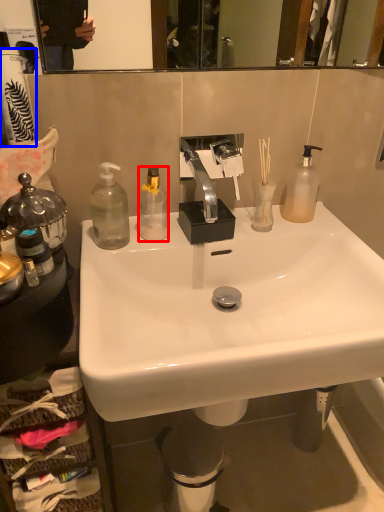
Question: Among these objects, which one is farthest to the camera, bottle (highlighted by a red box) or toilet paper (highlighted by a blue box)?

Choices:
 (A) bottle
 (B) toilet paper

Answer: (A)